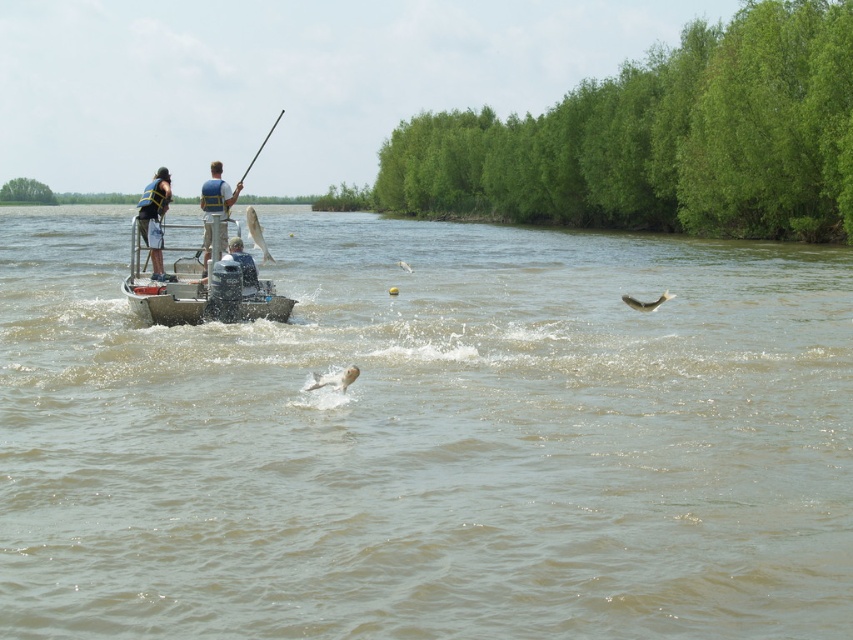
Is point (257, 244) less distant than point (666, 291)?

That is True.

Is point (264, 250) farther from camera compared to point (659, 300)?

Yes.

Describe the element at coordinates (256, 234) in the screenshot. I see `white matte fish at upper center` at that location.

The height and width of the screenshot is (640, 853). In order to click on white matte fish at upper center in this screenshot , I will do `click(256, 234)`.

Can you confirm if brown murky water at center is smaller than matte black life vest at left?

No, brown murky water at center is not smaller than matte black life vest at left.

This screenshot has width=853, height=640. Find the location of `brown murky water at center`. brown murky water at center is located at coordinates (428, 438).

Image resolution: width=853 pixels, height=640 pixels. In order to click on brown murky water at center in this screenshot , I will do `click(428, 438)`.

Which is behind, point (221, 301) or point (402, 266)?

Point (402, 266)

Between point (141, 282) and point (398, 262), which one is positioned in front?

Positioned in front is point (141, 282).

Who is more forward, (187, 280) or (409, 268)?

Point (187, 280)

In order to click on metallic gray boat at center in this screenshot , I will do `click(199, 294)`.